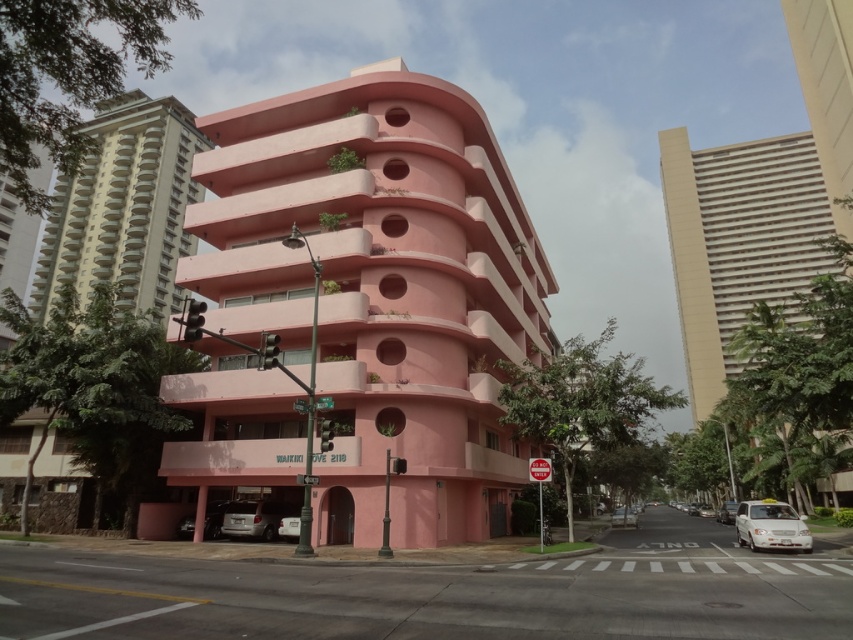
Question: Is silver metallic car at lower left closer to camera compared to white glossy sedan at center-right?

Choices:
 (A) no
 (B) yes

Answer: (B)

Question: Which of the following is the farthest from the observer?

Choices:
 (A) white glossy sedan at center-right
 (B) metallic silver car at lower left

Answer: (A)

Question: Which object is positioned closest to the silver metallic car at lower left?

Choices:
 (A) pink matte building at center
 (B) white glossy sedan at center-right
 (C) beige concrete tower at upper left

Answer: (A)

Question: Is pink matte building at center to the right of beige concrete tower at upper left from the viewer's perspective?

Choices:
 (A) no
 (B) yes

Answer: (B)

Question: Estimate the real-world distances between objects in this image. Which object is closer to the white glossy sedan at lower right?

Choices:
 (A) beige concrete tower at upper left
 (B) white glossy sedan at center-right
 (C) pink matte building at center

Answer: (C)

Question: Is white glossy sedan at lower right to the left of silver metallic car at lower left from the viewer's perspective?

Choices:
 (A) no
 (B) yes

Answer: (A)